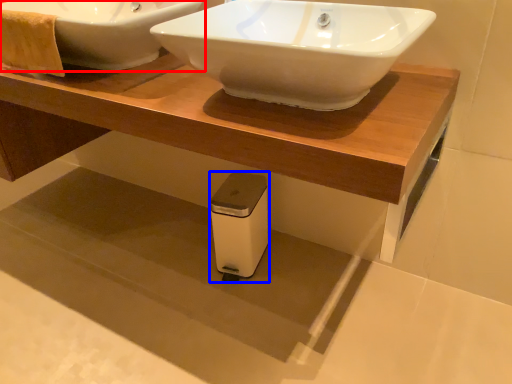
Question: Which object is closer to the camera taking this photo, sink (highlighted by a red box) or appliance (highlighted by a blue box)?

Choices:
 (A) sink
 (B) appliance

Answer: (A)